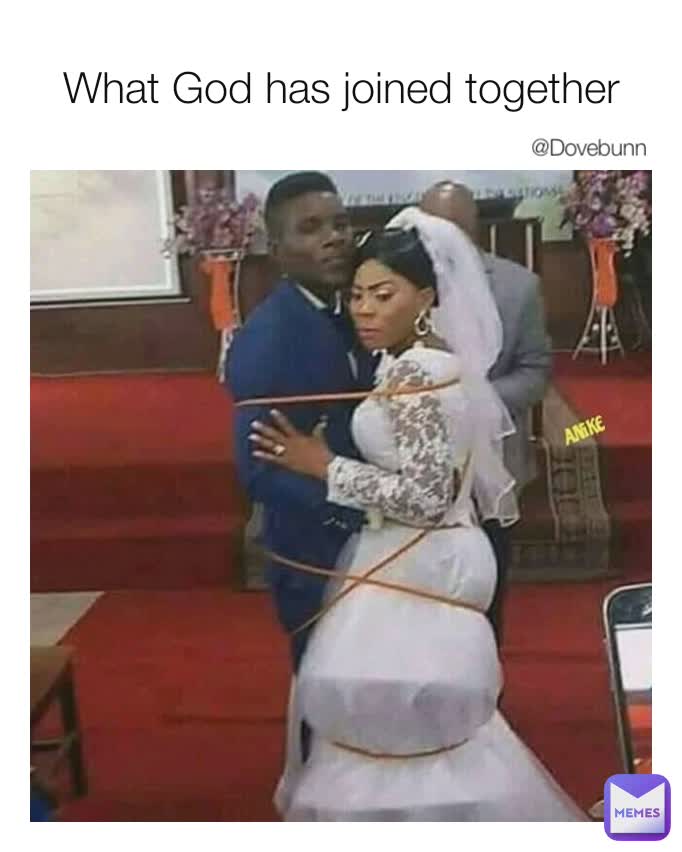
The image size is (682, 852). What are the coordinates of `wooden chair` in the screenshot? It's located at (59, 665).